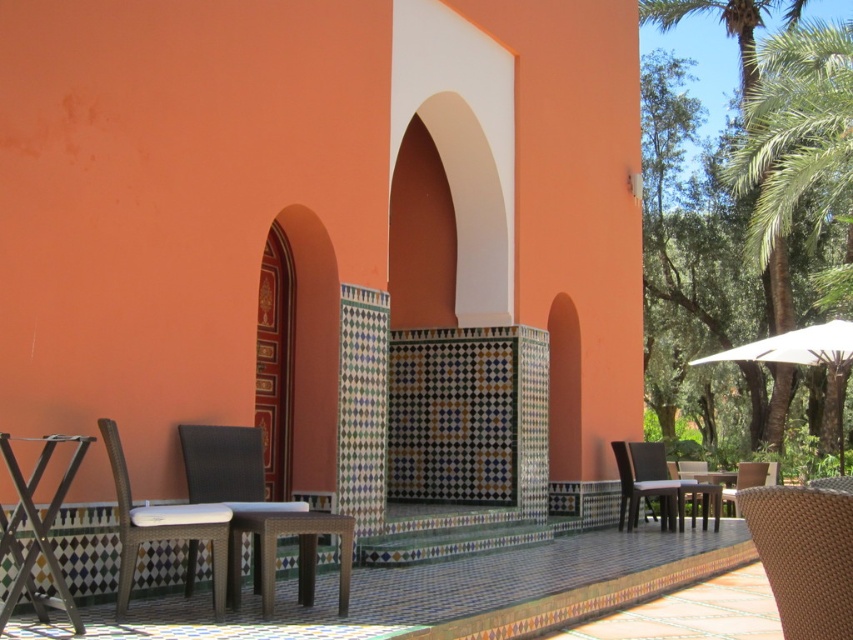
Question: Which object is the farthest from the matte gray chair at lower left?

Choices:
 (A) brown woven chair at right
 (B) matte brown table at center
 (C) matte wicker chair at lower left

Answer: (A)

Question: Which object is farther from the camera taking this photo?

Choices:
 (A) green leafy palm tree at right
 (B) metallic silver table at lower left

Answer: (A)

Question: Does metallic silver table at lower left appear on the left side of matte plastic table at center?

Choices:
 (A) no
 (B) yes

Answer: (B)

Question: Is the position of matte brown table at center less distant than that of woven wicker chair at lower right?

Choices:
 (A) yes
 (B) no

Answer: (A)

Question: Which is nearer to the white fabric umbrella at right?

Choices:
 (A) green leafy palm tree at right
 (B) matte gray chair at lower left

Answer: (B)

Question: Is woven rattan chair at lower right positioned in front of brown woven chair at right?

Choices:
 (A) no
 (B) yes

Answer: (B)